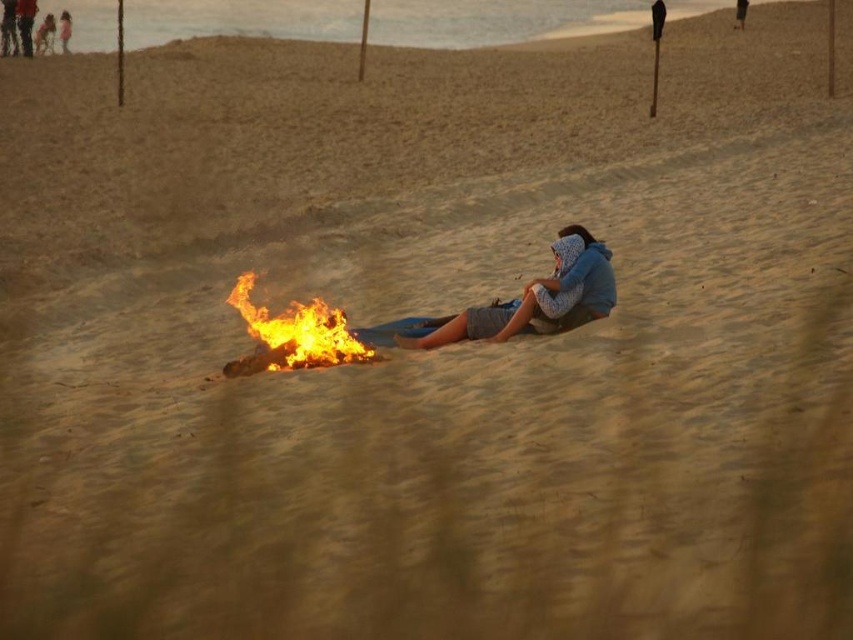
Does blue cotton hoodie at center appear on the left side of flaming yellow-orange fire at center?

Incorrect, blue cotton hoodie at center is not on the left side of flaming yellow-orange fire at center.

Is point (550, 275) positioned after point (257, 326)?

That is True.

Locate an element on the screen. blue cotton hoodie at center is located at coordinates (538, 300).

Looking at this image, is flaming yellow-orange fire at center to the left of dark blue jeans at upper left from the viewer's perspective?

In fact, flaming yellow-orange fire at center is to the right of dark blue jeans at upper left.

Between flaming yellow-orange fire at center and dark blue jeans at upper left, which one appears on the right side from the viewer's perspective?

flaming yellow-orange fire at center

Is point (282, 365) positioned after point (27, 12)?

That is False.

Where is `flaming yellow-orange fire at center`? flaming yellow-orange fire at center is located at coordinates (293, 333).

Does blue cotton hoodie at center have a lesser width compared to dark blue jeans at upper left?

No, blue cotton hoodie at center is not thinner than dark blue jeans at upper left.

Can you confirm if blue cotton hoodie at center is wider than dark blue jeans at upper left?

Yes.

Is point (479, 320) closer to viewer compared to point (30, 4)?

Yes.

You are a GUI agent. You are given a task and a screenshot of the screen. Output one action in this format:
    pyautogui.click(x=<x>, y=<y>)
    Task: Click on the blue cotton hoodie at center
    The width and height of the screenshot is (853, 640).
    Given the screenshot: What is the action you would take?
    pyautogui.click(x=538, y=300)